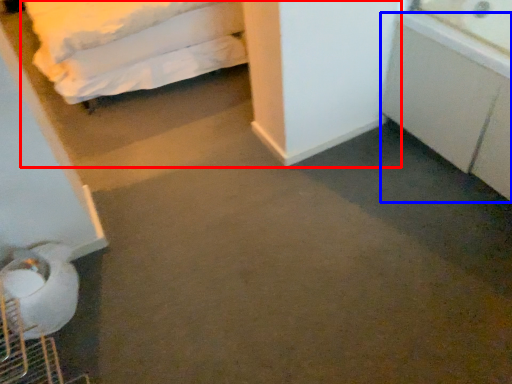
Question: Among these objects, which one is farthest to the camera, bed (highlighted by a red box) or cabinetry (highlighted by a blue box)?

Choices:
 (A) bed
 (B) cabinetry

Answer: (A)